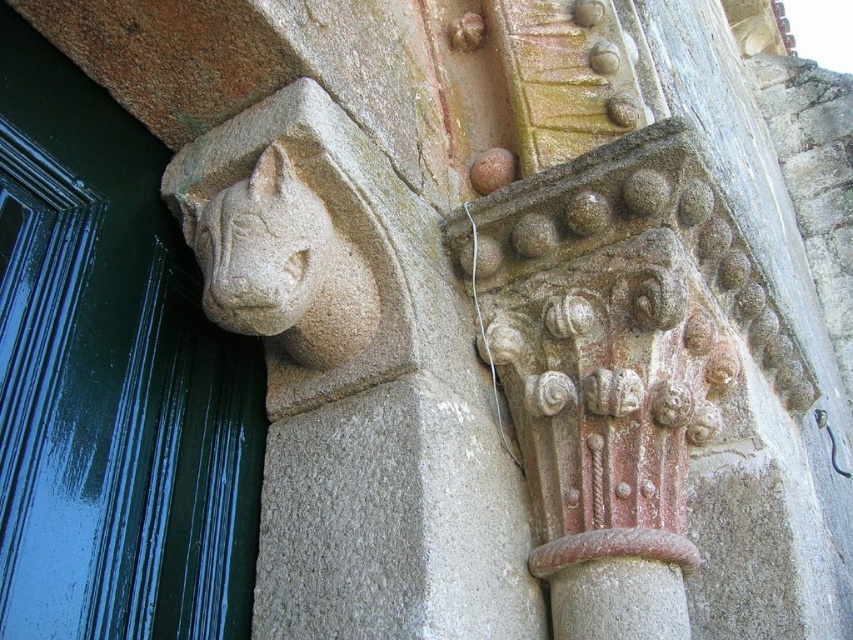
Question: Is gray stone lion head at upper left to the right of green glossy door at left from the viewer's perspective?

Choices:
 (A) yes
 (B) no

Answer: (A)

Question: Does green glossy door at left appear on the left side of stone carved gargoyle at upper left?

Choices:
 (A) no
 (B) yes

Answer: (B)

Question: Which is nearer to the green glossy door at left?

Choices:
 (A) gray stone lion head at upper left
 (B) stone carved gargoyle at upper left

Answer: (B)

Question: Which point is closer to the camera taking this photo?

Choices:
 (A) (463, 493)
 (B) (322, 220)
 (C) (148, 284)

Answer: (B)

Question: Is green glossy door at left further to camera compared to stone carved gargoyle at upper left?

Choices:
 (A) no
 (B) yes

Answer: (A)

Question: Considering the real-world distances, which object is closest to the stone carved gargoyle at upper left?

Choices:
 (A) gray stone lion head at upper left
 (B) green glossy door at left

Answer: (A)